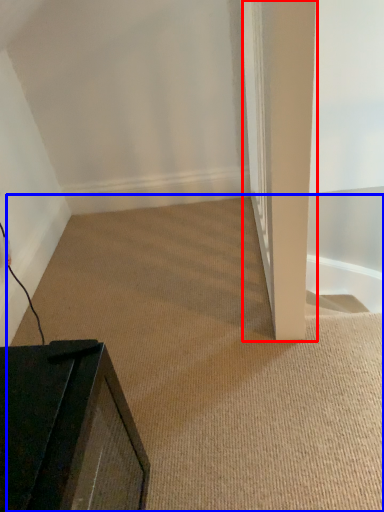
Question: Which point is further to the camera, pillar (highlighted by a red box) or plain (highlighted by a blue box)?

Choices:
 (A) pillar
 (B) plain

Answer: (B)